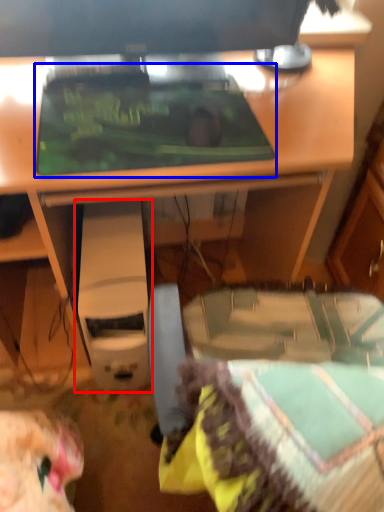
Question: Among these objects, which one is nearest to the camera, computer (highlighted by a red box) or crt screen (highlighted by a blue box)?

Choices:
 (A) computer
 (B) crt screen

Answer: (B)